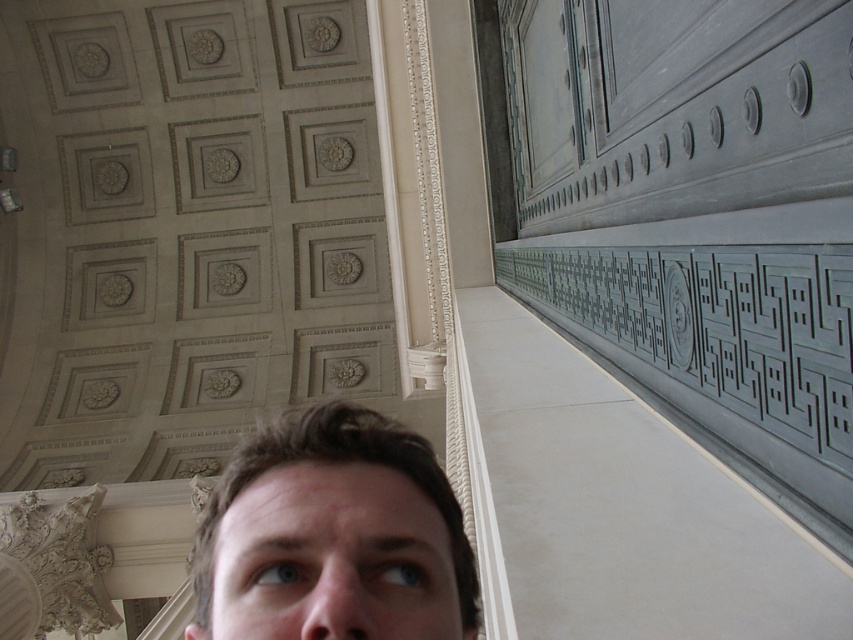
Is brown hair at center wider than gray stone carving at right?

Correct, the width of brown hair at center exceeds that of gray stone carving at right.

Can you confirm if brown hair at center is positioned below gray stone carving at right?

Yes.

The width and height of the screenshot is (853, 640). In order to click on brown hair at center in this screenshot , I will do `click(334, 536)`.